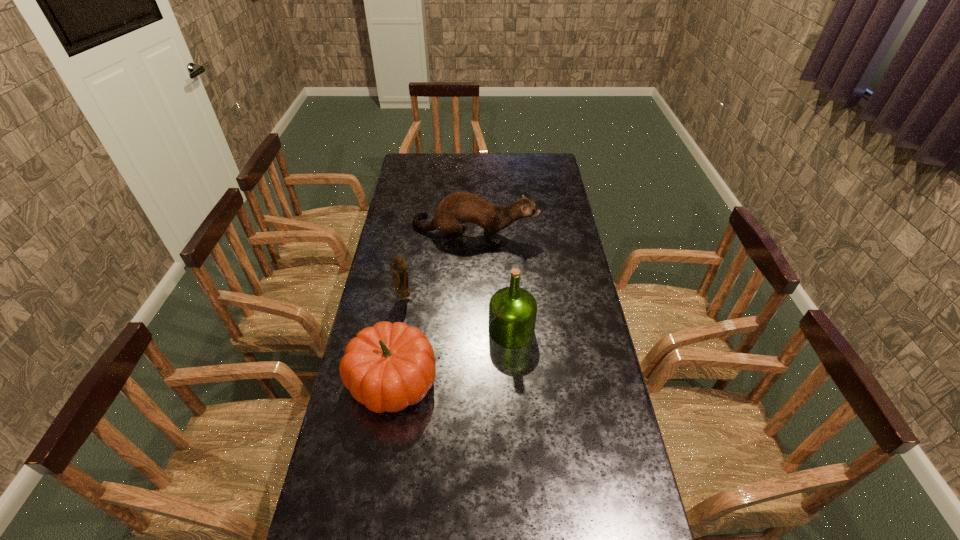
Locate an element on the screen. The height and width of the screenshot is (540, 960). pumpkin at the left edge is located at coordinates (387, 367).

You are a GUI agent. You are given a task and a screenshot of the screen. Output one action in this format:
    pyautogui.click(x=<x>, y=<y>)
    Task: Click on the object present at the right edge
    The image size is (960, 540).
    Given the screenshot: What is the action you would take?
    pyautogui.click(x=457, y=208)

You are a GUI agent. You are given a task and a screenshot of the screen. Output one action in this format:
    pyautogui.click(x=<x>, y=<y>)
    Task: Click on the vacant space at the far edge of the desktop
    
    Given the screenshot: What is the action you would take?
    pyautogui.click(x=454, y=171)

The image size is (960, 540). In the image, there is a desktop. In order to click on vacant space at the left edge in this screenshot , I will do `click(355, 462)`.

Identify the location of vacant space at the right edge of the desktop. (576, 440).

Identify the location of vacant region between the ferret and the tallest object. The width and height of the screenshot is (960, 540). (492, 280).

At what (x,y) coordinates should I click in order to perform the action: click on free spot between the figurine and the ferret. Please return your answer as a coordinate pair (x, y). The height and width of the screenshot is (540, 960). Looking at the image, I should click on tap(440, 264).

You are a GUI agent. You are given a task and a screenshot of the screen. Output one action in this format:
    pyautogui.click(x=<x>, y=<y>)
    Task: Click on the free space that is in between the tallest object and the figurine
    
    Given the screenshot: What is the action you would take?
    pyautogui.click(x=458, y=314)

At what (x,y) coordinates should I click in order to perform the action: click on vacant area that lies between the ferret and the pumpkin. Please return your answer as a coordinate pair (x, y). Looking at the image, I should click on (434, 306).

This screenshot has width=960, height=540. Identify the location of free space between the olive oil and the figurine. (458, 314).